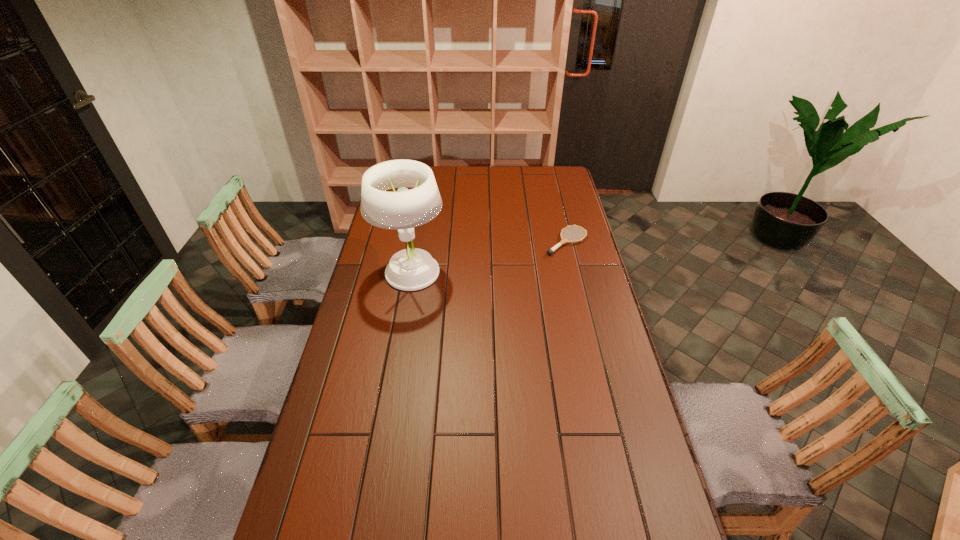
I want to click on the tallest object, so click(411, 269).

At what (x,y) coordinates should I click in order to perform the action: click on icecream. Please return your answer as a coordinate pair (x, y). The width and height of the screenshot is (960, 540). Looking at the image, I should click on [400, 189].

Where is `the second shortest object`? The height and width of the screenshot is (540, 960). the second shortest object is located at coordinates tap(400, 189).

The height and width of the screenshot is (540, 960). Find the location of `the shortest object`. the shortest object is located at coordinates (550, 251).

Locate an element on the screen. This screenshot has height=540, width=960. tennis racket is located at coordinates (550, 251).

Where is `vacant position located 0.220m on the front-facing side of the lamp`? vacant position located 0.220m on the front-facing side of the lamp is located at coordinates (398, 346).

The image size is (960, 540). I want to click on free space located on the back of the icecream, so click(416, 168).

In order to click on blank space located 0.140m on the back of the tennis racket in this screenshot , I will do `click(559, 210)`.

You are a GUI agent. You are given a task and a screenshot of the screen. Output one action in this format:
    pyautogui.click(x=<x>, y=<y>)
    Task: Click on the lamp at the left edge
    
    Given the screenshot: What is the action you would take?
    pyautogui.click(x=411, y=269)

At what (x,y) coordinates should I click in order to perform the action: click on icecream situated at the left edge. Please return your answer as a coordinate pair (x, y). Image resolution: width=960 pixels, height=540 pixels. Looking at the image, I should click on (400, 189).